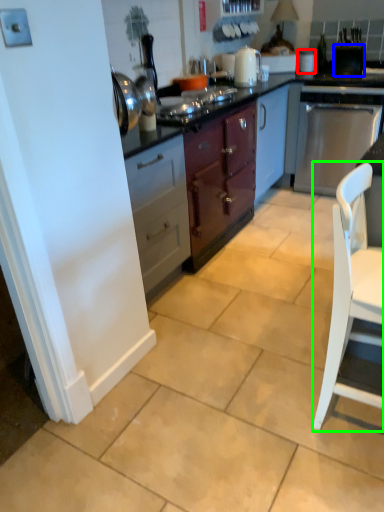
Question: Which object is the closest to the appliance (highlighted by a red box)? Choose among these: appliance (highlighted by a blue box) or chair (highlighted by a green box).

Choices:
 (A) appliance
 (B) chair

Answer: (A)